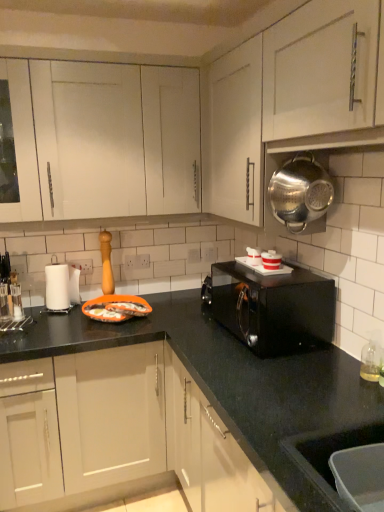
You are a GUI agent. You are given a task and a screenshot of the screen. Output one action in this format:
    pyautogui.click(x=<x>, y=<y>)
    Task: Click on the vacant space underneath metallic silver strainer at upper right, the first appliance when ordered from front to back (from a real-world perspective)
    Image resolution: width=384 pixels, height=512 pixels.
    Given the screenshot: What is the action you would take?
    pyautogui.click(x=301, y=281)